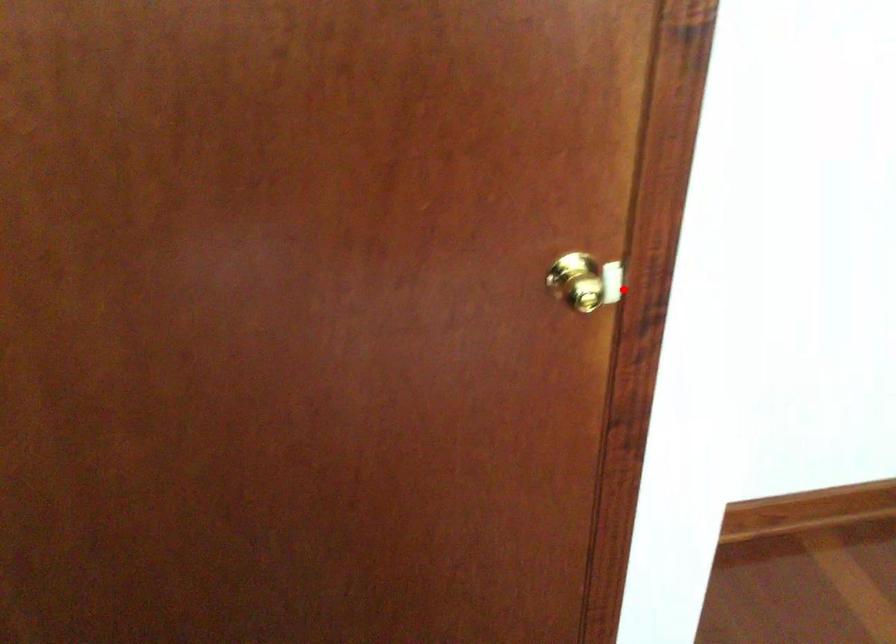
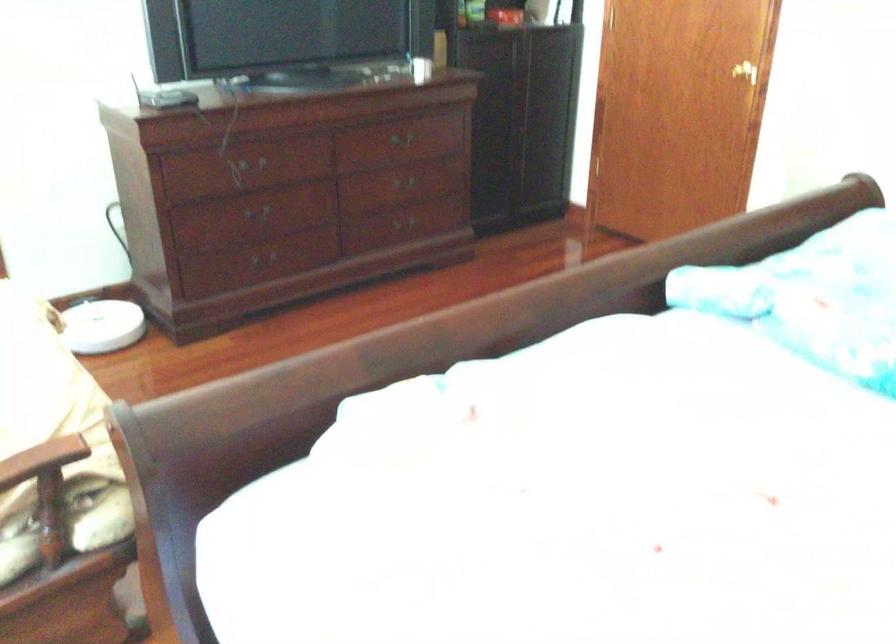
In the second image, find the point that corresponds to the highlighted location in the first image.

(745, 71)